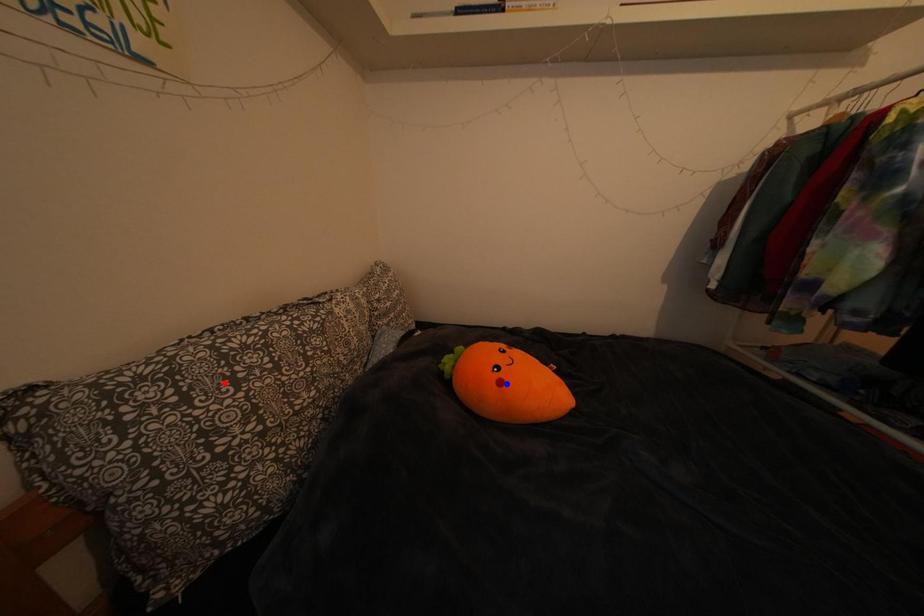
Question: Which of the two points in the image is closer to the camera?

Choices:
 (A) Blue point is closer.
 (B) Red point is closer.

Answer: (B)